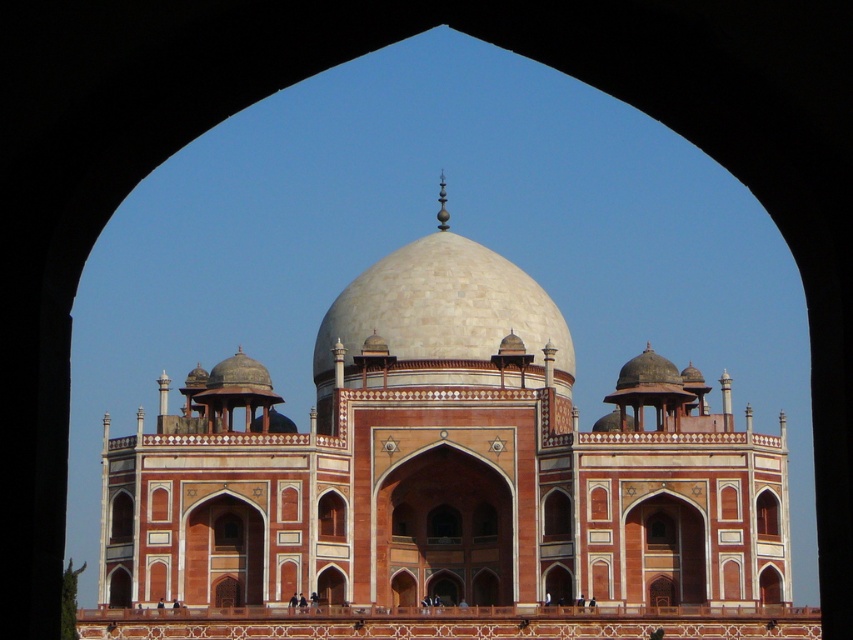
Which is more to the left, beige stone mosque at center or white marble dome at center?

white marble dome at center is more to the left.

Image resolution: width=853 pixels, height=640 pixels. Identify the location of beige stone mosque at center. (444, 481).

The image size is (853, 640). Find the location of `beige stone mosque at center`. beige stone mosque at center is located at coordinates click(444, 481).